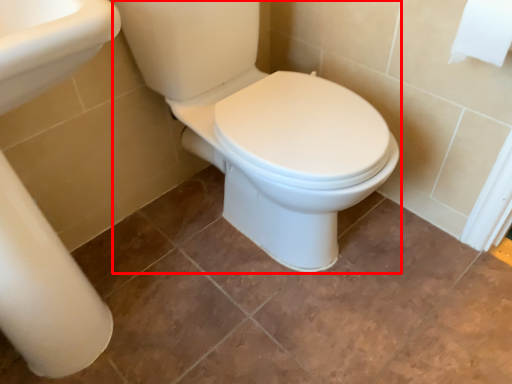
Question: From the image's perspective, where is porcelain (annotated by the red box) located relative to toilet paper?

Choices:
 (A) above
 (B) below

Answer: (B)